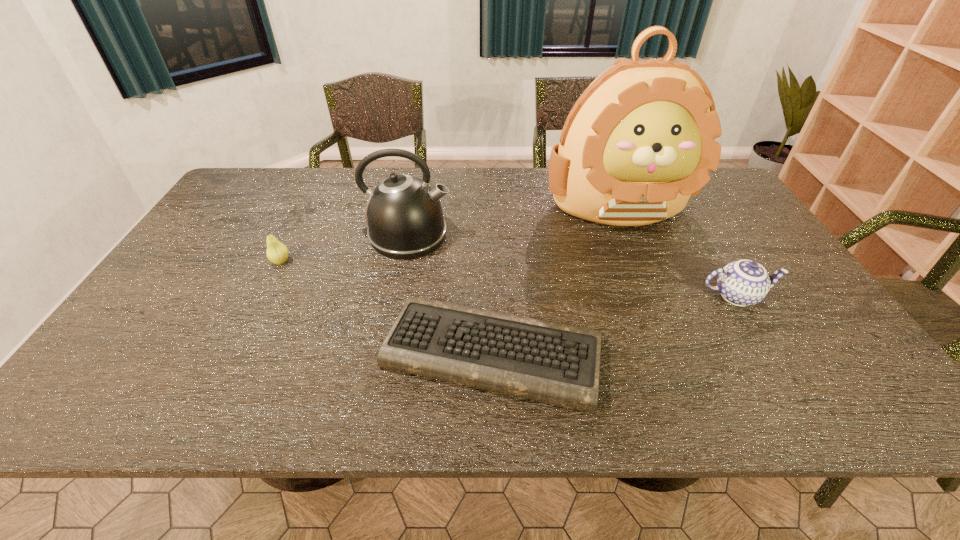
This screenshot has height=540, width=960. Find the location of `free space between the pear and the tallest object`. free space between the pear and the tallest object is located at coordinates (449, 233).

You are a GUI agent. You are given a task and a screenshot of the screen. Output one action in this format:
    pyautogui.click(x=<x>, y=<y>)
    Task: Click on the free space between the chinaware and the backpack
    The image size is (960, 540).
    Given the screenshot: What is the action you would take?
    pyautogui.click(x=677, y=250)

Identify which object is the second nearest to the pear. Please provide its 2D coordinates. Your answer should be formatted as a tuple, i.e. [(x, y)], where the tuple contains the x and y coordinates of a point satisfying the conditions above.

[(559, 364)]

Identify the location of object that is the third closest to the shortest object. (742, 283).

Image resolution: width=960 pixels, height=540 pixels. Identify the location of free location that satisfies the following two spatial constraints: 1. on the front side of the computer keyboard; 2. on the right side of the pear. (237, 352).

This screenshot has height=540, width=960. I want to click on free region that satisfies the following two spatial constraints: 1. on the front side of the computer keyboard; 2. on the left side of the leftmost object, so click(237, 352).

Where is `free spot that satisfies the following two spatial constraints: 1. on the front-facing side of the backpack; 2. on the spout of the fourth shortest object`? This screenshot has height=540, width=960. free spot that satisfies the following two spatial constraints: 1. on the front-facing side of the backpack; 2. on the spout of the fourth shortest object is located at coordinates (630, 235).

Find the location of a particular element. The width and height of the screenshot is (960, 540). free space that satisfies the following two spatial constraints: 1. on the spout of the computer keyboard; 2. on the right side of the kettle is located at coordinates (384, 352).